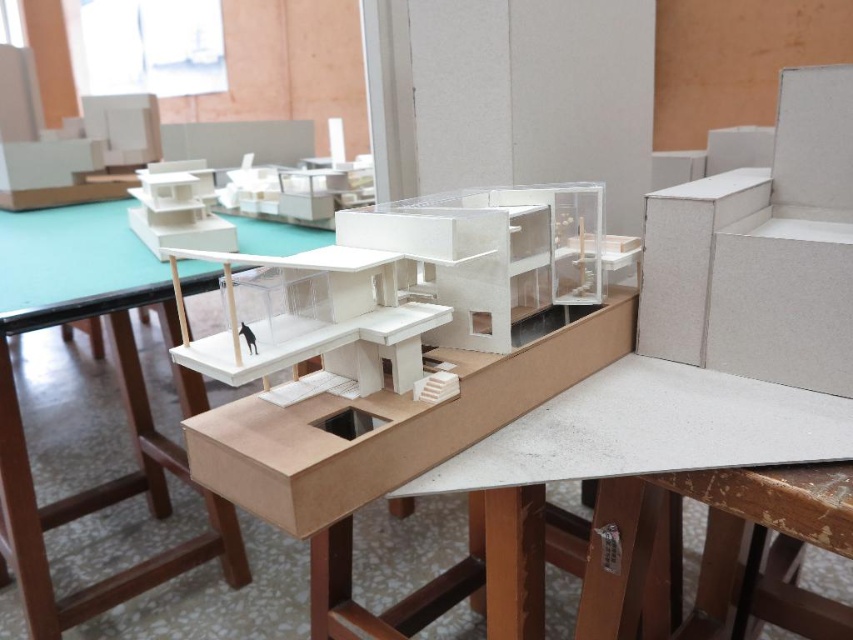
Question: Among these objects, which one is nearest to the camera?

Choices:
 (A) white cardboard table at center
 (B) white matte dog at center

Answer: (B)

Question: Among these objects, which one is nearest to the camera?

Choices:
 (A) white matte dog at center
 (B) white cardboard table at center

Answer: (A)

Question: Is the position of white cardboard table at center more distant than that of white matte dog at center?

Choices:
 (A) yes
 (B) no

Answer: (A)

Question: Does white cardboard table at center appear under white matte dog at center?

Choices:
 (A) no
 (B) yes

Answer: (B)

Question: Can you confirm if white cardboard table at center is positioned to the left of white matte dog at center?

Choices:
 (A) yes
 (B) no

Answer: (A)